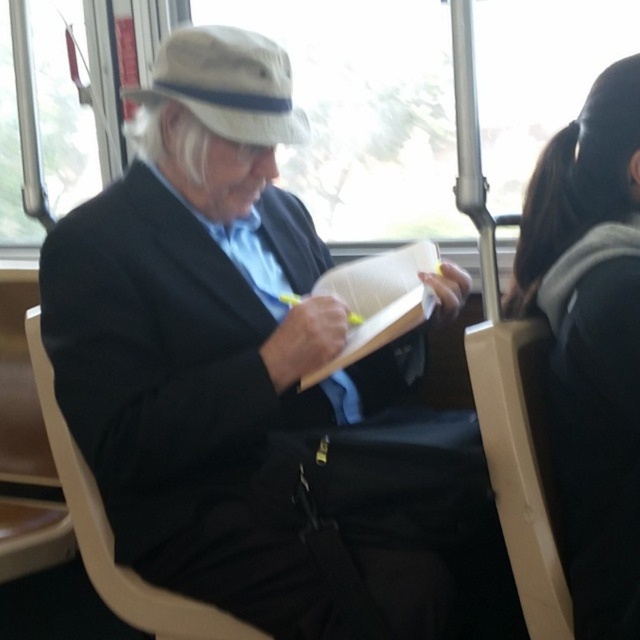
Which is below, matte black book at center or beige plastic chair at right?

Positioned lower is beige plastic chair at right.

The height and width of the screenshot is (640, 640). What do you see at coordinates (256, 384) in the screenshot?
I see `matte black book at center` at bounding box center [256, 384].

Identify the location of matte black book at center. The height and width of the screenshot is (640, 640). (256, 384).

Can you confirm if dark gray hair at upper right is positioned below beige plastic chair at left?

Actually, dark gray hair at upper right is above beige plastic chair at left.

Between point (572, 152) and point (176, 620), which one is positioned behind?

Point (176, 620)

Describe the element at coordinates (592, 340) in the screenshot. I see `dark gray hair at upper right` at that location.

At what (x,y) coordinates should I click in order to perform the action: click on dark gray hair at upper right. Please return your answer as a coordinate pair (x, y). This screenshot has height=640, width=640. Looking at the image, I should click on (592, 340).

Is beige plastic chair at right positioned behind beige plastic chair at left?

No, beige plastic chair at right is closer to the viewer.

Is beige plastic chair at right above beige plastic chair at left?

Correct, beige plastic chair at right is located above beige plastic chair at left.

Where is `beige plastic chair at right`? The width and height of the screenshot is (640, 640). beige plastic chair at right is located at coordinates (520, 465).